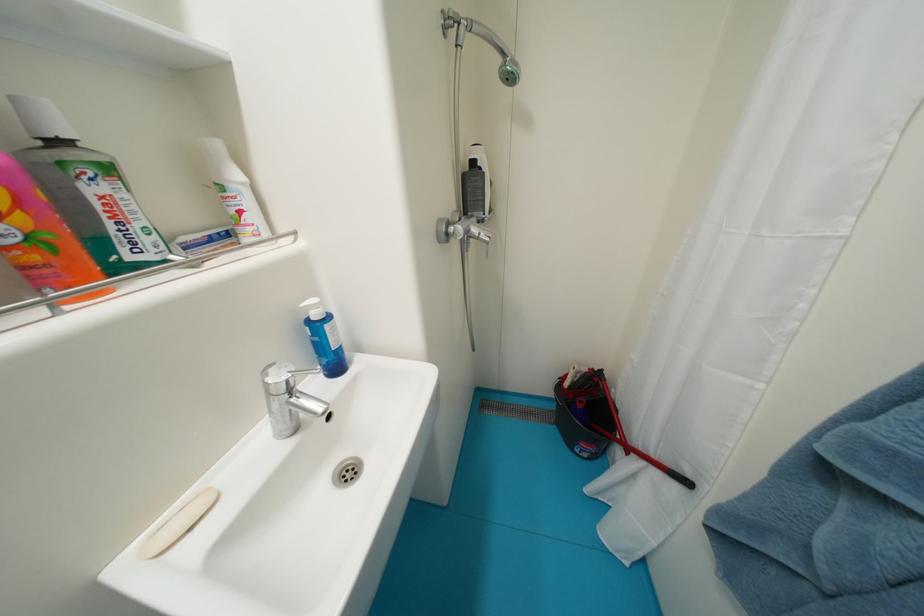
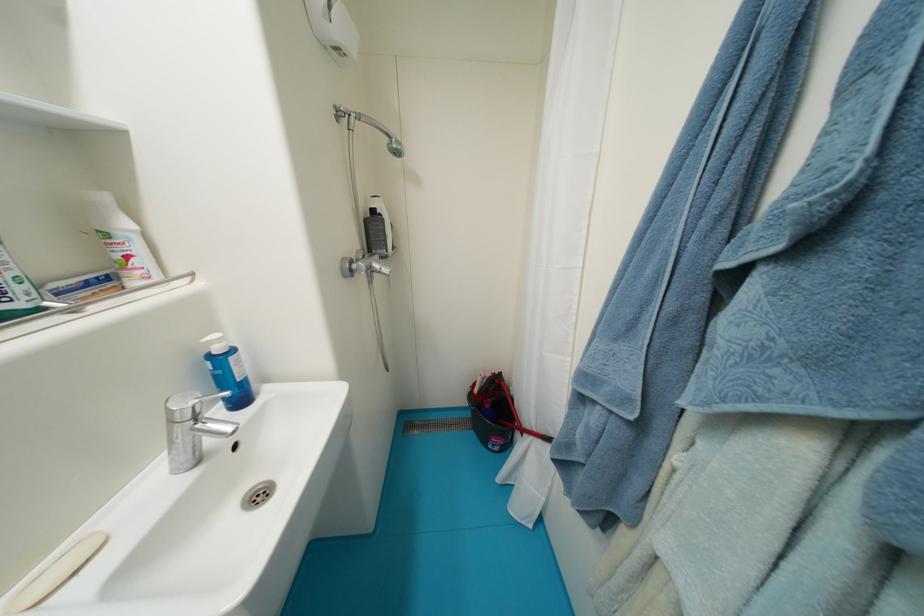
In the second image, find the point that corresponds to point (297, 392) in the first image.

(203, 419)